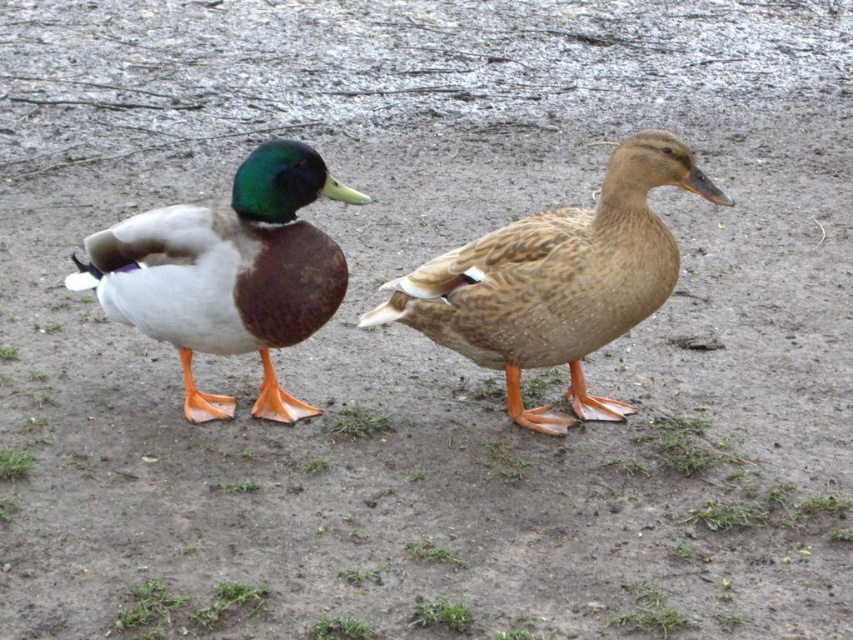
Is brown feathered duck at center below matte brown duck at left?

Yes.

Between brown feathered duck at center and matte brown duck at left, which one has less height?

Standing shorter between the two is matte brown duck at left.

Between point (577, 241) and point (173, 227), which one is positioned in front?

Positioned in front is point (577, 241).

I want to click on brown feathered duck at center, so click(556, 280).